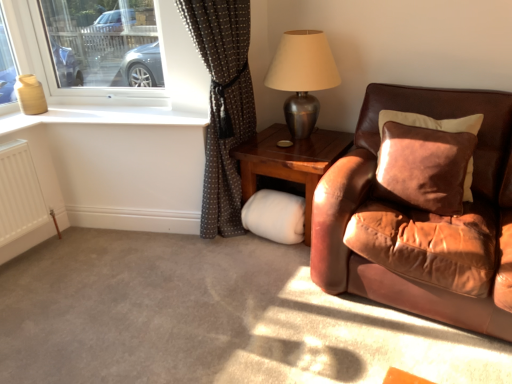
The height and width of the screenshot is (384, 512). I want to click on vacant region under metallic silver table lamp at upper right (from a real-world perspective), so click(307, 143).